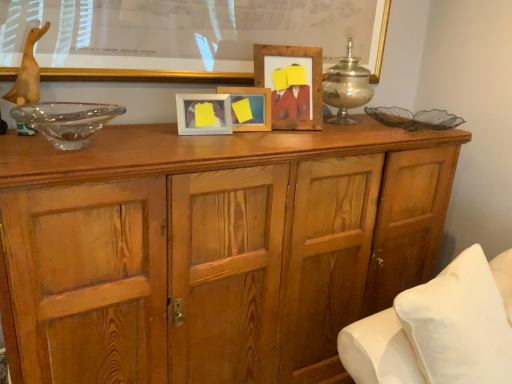
In order to click on vacant point to the right of wooden picture frame at center, which ranks as the 1th picture frame in right-to-left order in this screenshot , I will do `click(333, 124)`.